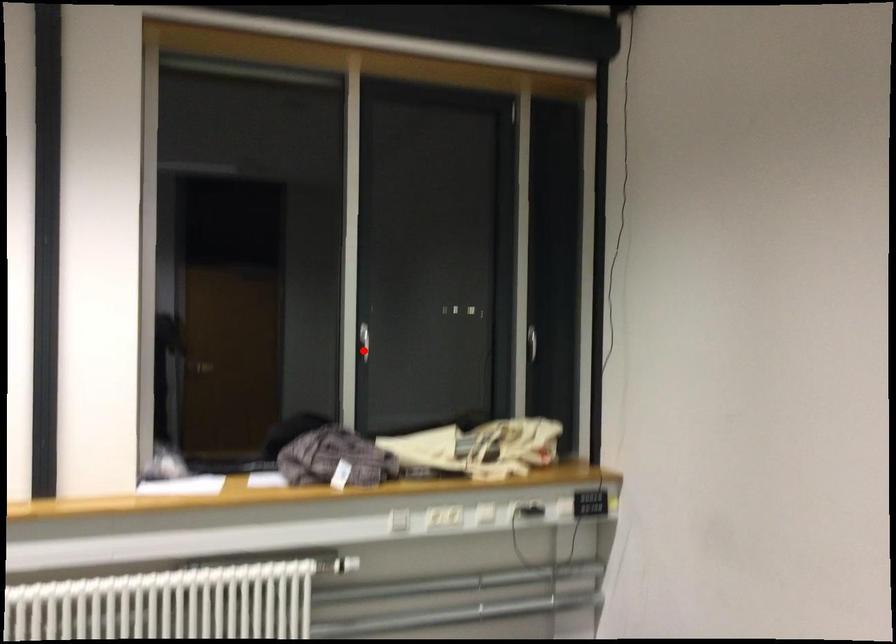
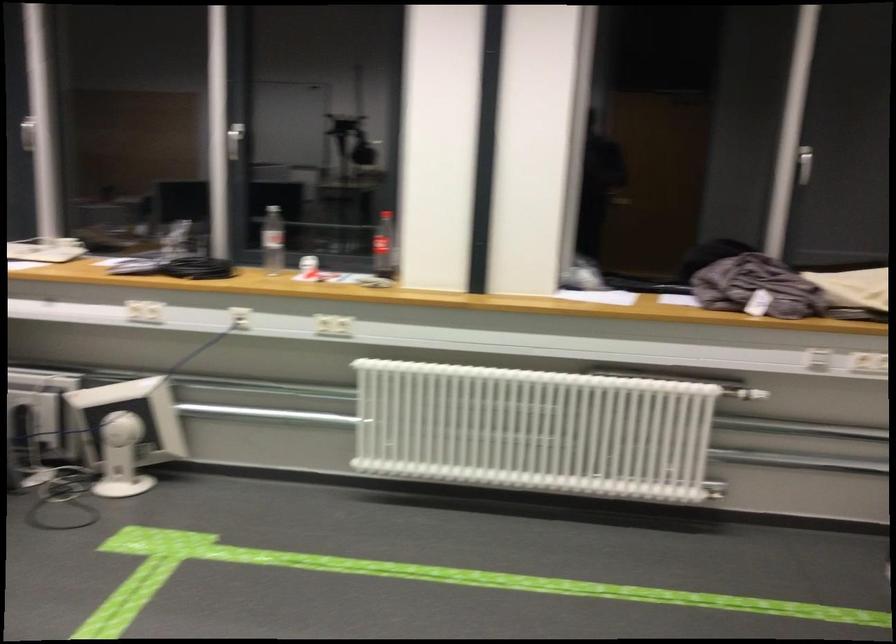
Locate, in the second image, the point that corresponds to the highlighted location in the first image.

(804, 164)